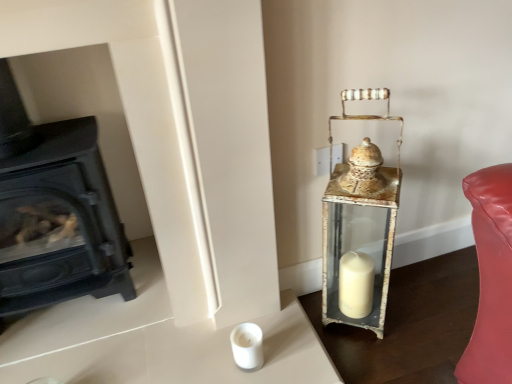
Where is `antique brass lantern at right`? This screenshot has width=512, height=384. antique brass lantern at right is located at coordinates (361, 214).

What do you see at coordinates (361, 214) in the screenshot? This screenshot has height=384, width=512. I see `antique brass lantern at right` at bounding box center [361, 214].

Describe the element at coordinates (60, 223) in the screenshot. I see `black matte wood burning stove at left` at that location.

Where is `black matte wood burning stove at left`? This screenshot has width=512, height=384. black matte wood burning stove at left is located at coordinates (x=60, y=223).

In order to face black matte wood burning stove at left, should I rotate leftwards or rightwards?

Turn left by 27.123 degrees to look at black matte wood burning stove at left.

Locate an element on the screen. The width and height of the screenshot is (512, 384). antique brass lantern at right is located at coordinates (361, 214).

Based on their positions, is black matte wood burning stove at left located to the left or right of antique brass lantern at right?

Based on their positions, black matte wood burning stove at left is located to the left of antique brass lantern at right.

From the picture: In the image, is black matte wood burning stove at left positioned in front of or behind antique brass lantern at right?

In the image, black matte wood burning stove at left appears in front of antique brass lantern at right.

Which is more distant, (39,237) or (346,167)?

Positioned behind is point (39,237).

From the image's perspective, is black matte wood burning stove at left located above antique brass lantern at right?

Yes, from the image's perspective, black matte wood burning stove at left is over antique brass lantern at right.

From a real-world perspective, is black matte wood burning stove at left positioned above or below antique brass lantern at right?

Clearly, from a real-world perspective, black matte wood burning stove at left is above antique brass lantern at right.

Considering the sizes of objects black matte wood burning stove at left and antique brass lantern at right in the image provided, who is thinner, black matte wood burning stove at left or antique brass lantern at right?

antique brass lantern at right.

Is black matte wood burning stove at left taller than antique brass lantern at right?

Indeed, black matte wood burning stove at left has a greater height compared to antique brass lantern at right.

Who is bigger, black matte wood burning stove at left or antique brass lantern at right?

black matte wood burning stove at left.

Is black matte wood burning stove at left not within antique brass lantern at right?

Yes, black matte wood burning stove at left is located beyond the bounds of antique brass lantern at right.

Is black matte wood burning stove at left next to antique brass lantern at right?

No, black matte wood burning stove at left is not beside antique brass lantern at right.

Could you tell me if black matte wood burning stove at left is facing antique brass lantern at right?

No, black matte wood burning stove at left is not oriented towards antique brass lantern at right.

Locate an element on the screen. The image size is (512, 384). wood burning stove above the antique brass lantern at right (from a real-world perspective) is located at coordinates (60, 223).

Visually, is antique brass lantern at right positioned to the left or to the right of black matte wood burning stove at left?

From the image, it's evident that antique brass lantern at right is to the right of black matte wood burning stove at left.

Which object is closer to the camera taking this photo, antique brass lantern at right or black matte wood burning stove at left?

black matte wood burning stove at left is closer to the camera.

Considering the points (373, 116) and (74, 203), which point is in front, point (373, 116) or point (74, 203)?

The point (74, 203) is in front.

From the image's perspective, is antique brass lantern at right above or below black matte wood burning stove at left?

antique brass lantern at right is situated lower than black matte wood burning stove at left in the image.

From a real-world perspective, does antique brass lantern at right sit lower than black matte wood burning stove at left?

Correct, in the physical world, antique brass lantern at right is lower than black matte wood burning stove at left.

Is antique brass lantern at right wider or thinner than black matte wood burning stove at left?

In the image, antique brass lantern at right appears to be more narrow than black matte wood burning stove at left.

Between antique brass lantern at right and black matte wood burning stove at left, which one has more height?

black matte wood burning stove at left.

Considering the relative sizes of antique brass lantern at right and black matte wood burning stove at left in the image provided, is antique brass lantern at right smaller than black matte wood burning stove at left?

Correct, antique brass lantern at right occupies less space than black matte wood burning stove at left.

Would you say antique brass lantern at right is inside or outside black matte wood burning stove at left?

antique brass lantern at right is spatially situated outside black matte wood burning stove at left.

Would you say antique brass lantern at right is a long distance from black matte wood burning stove at left?

Actually, antique brass lantern at right and black matte wood burning stove at left are a little close together.

Is antique brass lantern at right facing towards black matte wood burning stove at left?

No, antique brass lantern at right is not oriented towards black matte wood burning stove at left.

How different are the orientations of antique brass lantern at right and black matte wood burning stove at left in degrees?

antique brass lantern at right and black matte wood burning stove at left are facing 36.4 degrees away from each other.

This screenshot has width=512, height=384. I want to click on table lamp below the black matte wood burning stove at left (from the image's perspective), so click(361, 214).

The height and width of the screenshot is (384, 512). I want to click on table lamp below the black matte wood burning stove at left (from a real-world perspective), so click(x=361, y=214).

Where is `wood burning stove that is above the antique brass lantern at right (from the image's perspective)`? The width and height of the screenshot is (512, 384). wood burning stove that is above the antique brass lantern at right (from the image's perspective) is located at coordinates (60, 223).